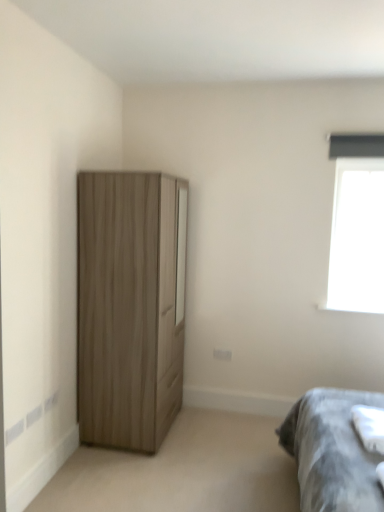
Where is `wooden wardrobe at left`? wooden wardrobe at left is located at coordinates (130, 306).

Can you tell me how much gray fabric bedsheet at lower right and wooden wardrobe at left differ in facing direction?

The angular difference between gray fabric bedsheet at lower right and wooden wardrobe at left is 176 degrees.

Is gray fabric bedsheet at lower right in front of wooden wardrobe at left?

Yes, gray fabric bedsheet at lower right is closer to the viewer.

From the picture: Is gray fabric bedsheet at lower right to the right of wooden wardrobe at left from the viewer's perspective?

Yes.

Consider the image. Could you tell me if wooden wardrobe at left is turned towards gray fabric bedsheet at lower right?

No.

From the image's perspective, which one is positioned higher, wooden wardrobe at left or gray fabric bedsheet at lower right?

wooden wardrobe at left appears higher in the image.

Is wooden wardrobe at left not near gray fabric bedsheet at lower right?

Indeed, wooden wardrobe at left is not near gray fabric bedsheet at lower right.

Locate an element on the screen. window that is above the wooden wardrobe at left (from a real-world perspective) is located at coordinates (357, 225).

From a real-world perspective, is wooden wardrobe at left on top of transparent glass window at upper right?

No, from a real-world perspective, wooden wardrobe at left is not on top of transparent glass window at upper right.

Which of these two, wooden wardrobe at left or transparent glass window at upper right, stands shorter?

Standing shorter between the two is transparent glass window at upper right.

Looking at this image, from the image's perspective, is wooden wardrobe at left under transparent glass window at upper right?

Yes, from the image's perspective, wooden wardrobe at left is beneath transparent glass window at upper right.

Is transparent glass window at upper right outside of gray fabric bedsheet at lower right?

Indeed, transparent glass window at upper right is completely outside gray fabric bedsheet at lower right.

How far apart are transparent glass window at upper right and gray fabric bedsheet at lower right?

transparent glass window at upper right and gray fabric bedsheet at lower right are 1.52 meters apart from each other.

Does transparent glass window at upper right come behind gray fabric bedsheet at lower right?

Yes, transparent glass window at upper right is further from the viewer.

Based on their sizes in the image, would you say transparent glass window at upper right is bigger or smaller than gray fabric bedsheet at lower right?

transparent glass window at upper right is bigger than gray fabric bedsheet at lower right.

Considering the relative sizes of gray fabric bedsheet at lower right and transparent glass window at upper right in the image provided, is gray fabric bedsheet at lower right taller than transparent glass window at upper right?

No, gray fabric bedsheet at lower right is not taller than transparent glass window at upper right.

Is gray fabric bedsheet at lower right not close to transparent glass window at upper right?

That's right, there is a large distance between gray fabric bedsheet at lower right and transparent glass window at upper right.

In terms of width, does gray fabric bedsheet at lower right look wider or thinner when compared to transparent glass window at upper right?

gray fabric bedsheet at lower right is wider than transparent glass window at upper right.

Consider the image. Can you confirm if gray fabric bedsheet at lower right is bigger than transparent glass window at upper right?

No, gray fabric bedsheet at lower right is not bigger than transparent glass window at upper right.

From the image's perspective, does transparent glass window at upper right appear lower than wooden wardrobe at left?

No, from the image's perspective, transparent glass window at upper right is not beneath wooden wardrobe at left.

Would you say transparent glass window at upper right is outside wooden wardrobe at left?

transparent glass window at upper right lies outside wooden wardrobe at left's area.

Looking at this image, between transparent glass window at upper right and wooden wardrobe at left, which one appears on the left side from the viewer's perspective?

wooden wardrobe at left is more to the left.

Locate an element on the screen. This screenshot has width=384, height=512. window that is above the wooden wardrobe at left (from a real-world perspective) is located at coordinates (357, 225).

At what (x,y) coordinates should I click in order to perform the action: click on cupboard on the left of the gray fabric bedsheet at lower right. Please return your answer as a coordinate pair (x, y). Looking at the image, I should click on (130, 306).

Locate an element on the screen. The width and height of the screenshot is (384, 512). sheet below the wooden wardrobe at left (from the image's perspective) is located at coordinates (369, 426).

When comparing their distances from gray fabric bedsheet at lower right, does wooden wardrobe at left or transparent glass window at upper right seem closer?

Based on the image, transparent glass window at upper right appears to be nearer to gray fabric bedsheet at lower right.

From the picture: Considering their positions, is gray fabric bedsheet at lower right positioned further to wooden wardrobe at left than transparent glass window at upper right?

transparent glass window at upper right.

Which object lies further to the anchor point wooden wardrobe at left, transparent glass window at upper right or gray fabric bedsheet at lower right?

transparent glass window at upper right lies further to wooden wardrobe at left than the other object.

Estimate the real-world distances between objects in this image. Which object is closer to transparent glass window at upper right, wooden wardrobe at left or gray fabric bedsheet at lower right?

gray fabric bedsheet at lower right.

From the image, which object appears to be nearer to gray fabric bedsheet at lower right, transparent glass window at upper right or wooden wardrobe at left?

transparent glass window at upper right is closer to gray fabric bedsheet at lower right.

Looking at the image, which one is located further to transparent glass window at upper right, gray fabric bedsheet at lower right or wooden wardrobe at left?

wooden wardrobe at left lies further to transparent glass window at upper right than the other object.

Where is `sheet situated between wooden wardrobe at left and transparent glass window at upper right from left to right`? This screenshot has width=384, height=512. sheet situated between wooden wardrobe at left and transparent glass window at upper right from left to right is located at coordinates (369, 426).